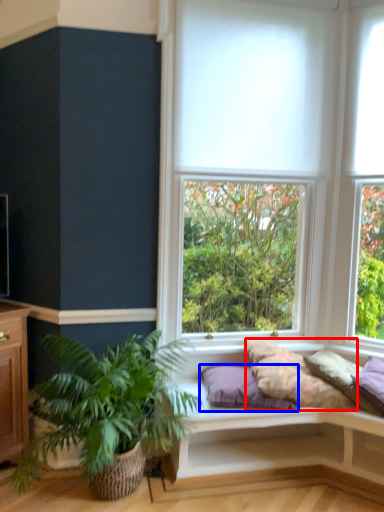
Question: Which object is further to the camera taking this photo, pillow (highlighted by a red box) or pillow (highlighted by a blue box)?

Choices:
 (A) pillow
 (B) pillow

Answer: (B)